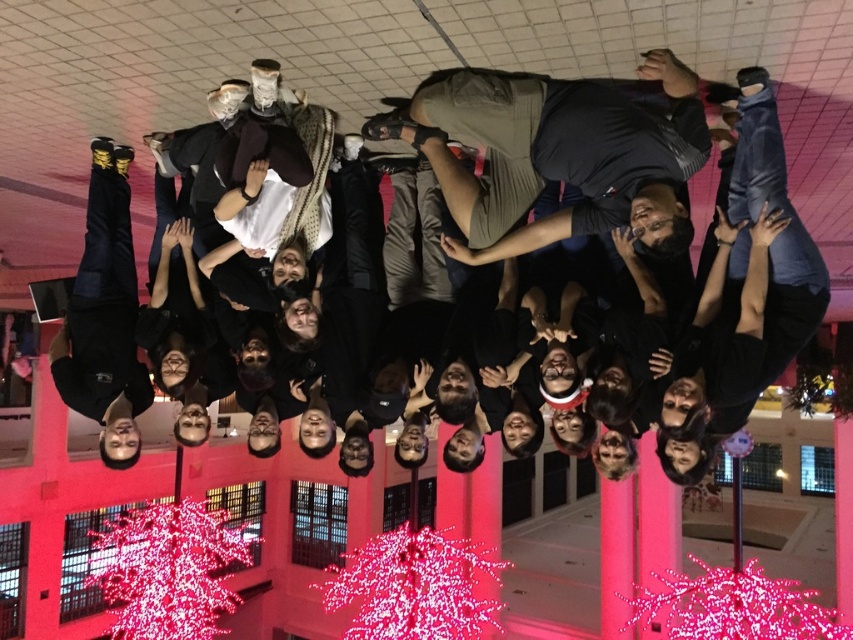
You are a photographer trying to capture the upside down group of people in the circular formation. You notice the black matte shirt at center and the khaki cotton shorts at center. Which clothing item is positioned lower on the person?

The black matte shirt at center is located below khaki cotton shorts at center, so the black matte shirt at center is positioned lower on the person.

You are standing at the point closest to the building in the image. Which point, point (401, 109) or point (578, 81), is farther away from you?

Point (401, 109) is farther away from you because it is behind point (578, 81).